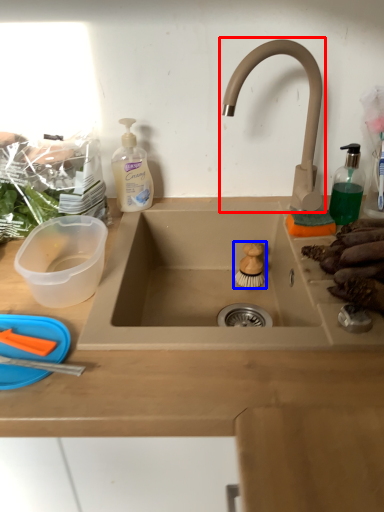
Question: Which point is closer to the camera, tap (highlighted by a red box) or food (highlighted by a blue box)?

Choices:
 (A) tap
 (B) food

Answer: (A)